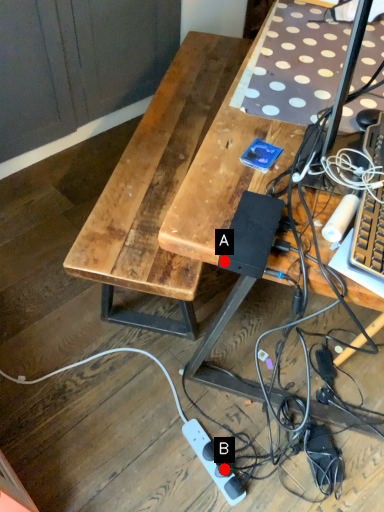
Question: Two points are circled on the image, labeled by A and B beside each circle. Which point appears closest to the camera in this image?

Choices:
 (A) A is closer
 (B) B is closer

Answer: (A)